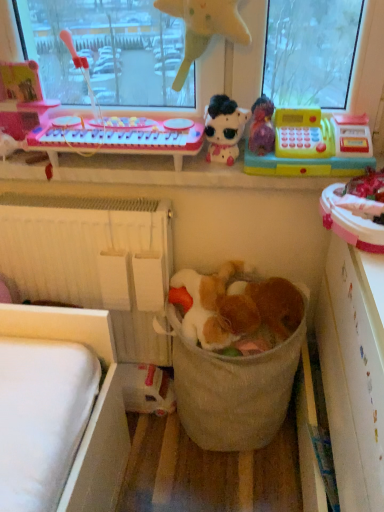
Locate an element on the screen. free space in front of white matte plush toy at upper center, which is the third toy in right-to-left order is located at coordinates (232, 174).